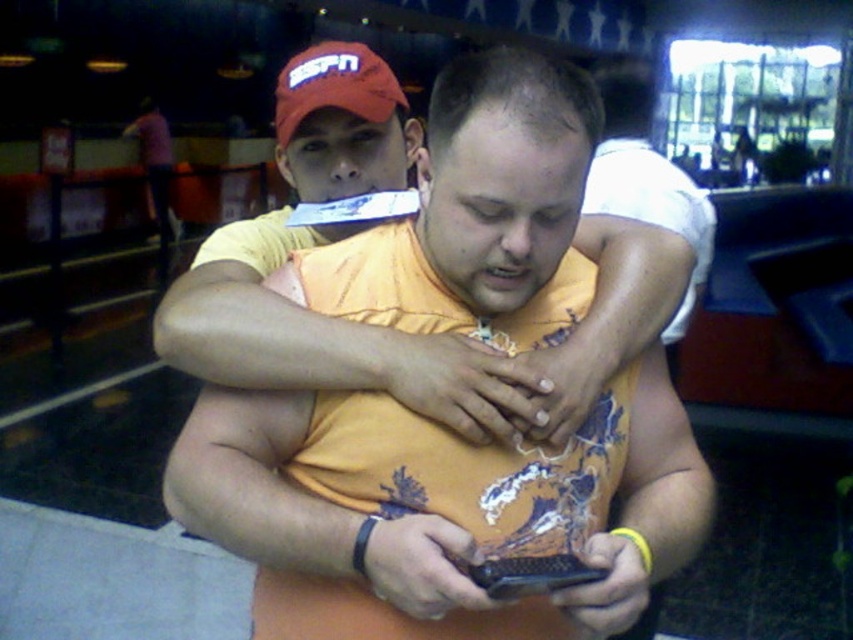
Which is above, red fabric cap at upper center or black textured phone at center?

red fabric cap at upper center

In the scene shown: Is red fabric cap at upper center closer to camera compared to black textured phone at center?

No, it is behind black textured phone at center.

Is point (369, 120) in front of point (544, 576)?

That is False.

Where is `red fabric cap at upper center`? red fabric cap at upper center is located at coordinates (334, 84).

Is point (468, 68) positioned after point (296, 128)?

No, (468, 68) is in front of (296, 128).

Who is lower down, orange printed shirt at center or red fabric cap at upper center?

Positioned lower is orange printed shirt at center.

Find the location of `orange printed shirt at center`. orange printed shirt at center is located at coordinates (437, 509).

Locate an element on the screen. The width and height of the screenshot is (853, 640). orange printed shirt at center is located at coordinates click(x=437, y=509).

Does orange printed shirt at center have a larger size compared to black textured phone at center?

Yes.

Is orange printed shirt at center positioned behind black textured phone at center?

Yes, it is.

Which is behind, point (210, 472) or point (498, 566)?

The point (210, 472) is more distant.

Where is `orange printed shirt at center`? orange printed shirt at center is located at coordinates (437, 509).